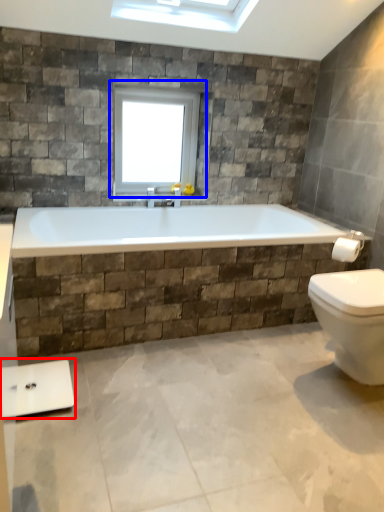
Question: Which object is closer to the camera taking this photo, scale (highlighted by a red box) or window (highlighted by a blue box)?

Choices:
 (A) scale
 (B) window

Answer: (A)